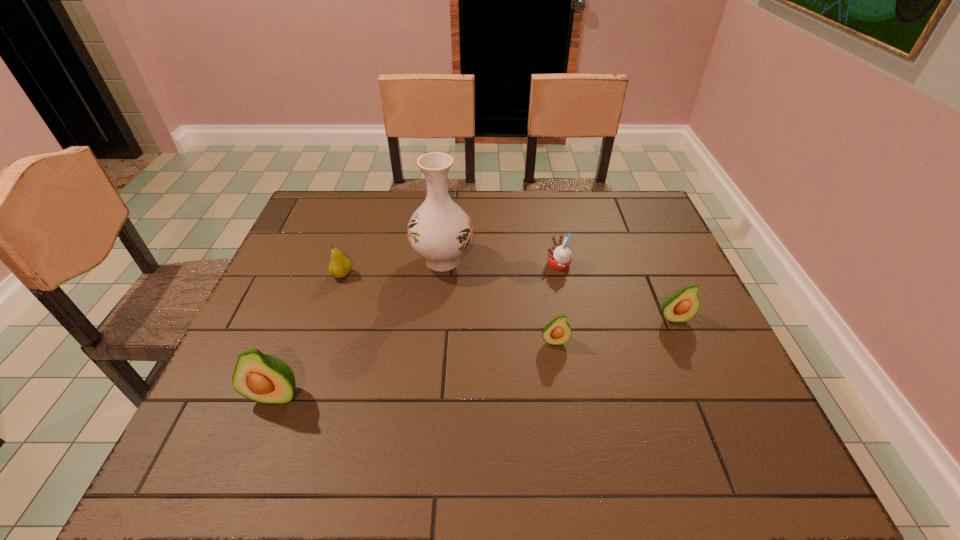
You are a GUI agent. You are given a task and a screenshot of the screen. Output one action in this format:
    pyautogui.click(x=<x>, y=<y>)
    Task: Click on the object that is at the right edge
    Image resolution: width=960 pixels, height=540 pixels.
    Given the screenshot: What is the action you would take?
    pyautogui.click(x=681, y=306)

Where is `object that is at the near left corner`? The height and width of the screenshot is (540, 960). object that is at the near left corner is located at coordinates (264, 378).

Where is `vacant space at the far edge of the desktop`? This screenshot has width=960, height=540. vacant space at the far edge of the desktop is located at coordinates (521, 197).

This screenshot has width=960, height=540. Identify the location of free space at the near edge of the desktop. (298, 413).

Where is `vacant space at the left edge of the desktop`? vacant space at the left edge of the desktop is located at coordinates (306, 259).

Locate an element on the screen. vacant space at the right edge of the desktop is located at coordinates (x=648, y=278).

Identify the location of vacant space at the far left corner of the desktop. (320, 216).

In the image, there is a desktop. Identify the location of vacant region at the far right corner. This screenshot has height=540, width=960. (605, 215).

Image resolution: width=960 pixels, height=540 pixels. Find the location of `vacant space that is in between the pear and the shortest avocado`. vacant space that is in between the pear and the shortest avocado is located at coordinates (448, 308).

This screenshot has height=540, width=960. Find the location of `vacant area that lies between the tallest avocado and the pear`. vacant area that lies between the tallest avocado and the pear is located at coordinates (309, 335).